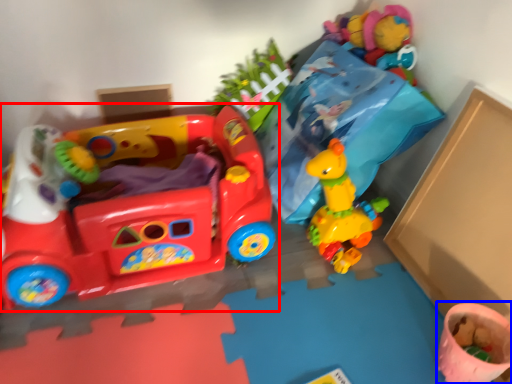
Question: Which object is further to the camera taking this photo, toy (highlighted by a red box) or toy (highlighted by a blue box)?

Choices:
 (A) toy
 (B) toy

Answer: (B)